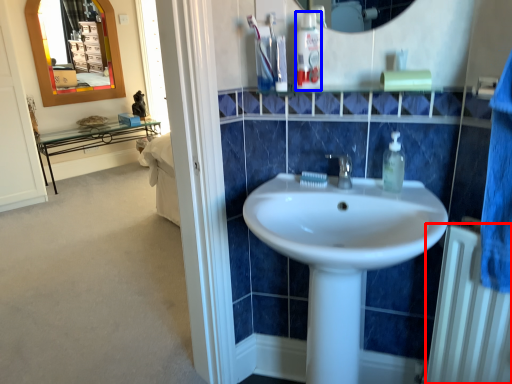
Question: Which of the following is the closest to the observer, radiator (highlighted by a red box) or mouthwash (highlighted by a blue box)?

Choices:
 (A) radiator
 (B) mouthwash

Answer: (A)